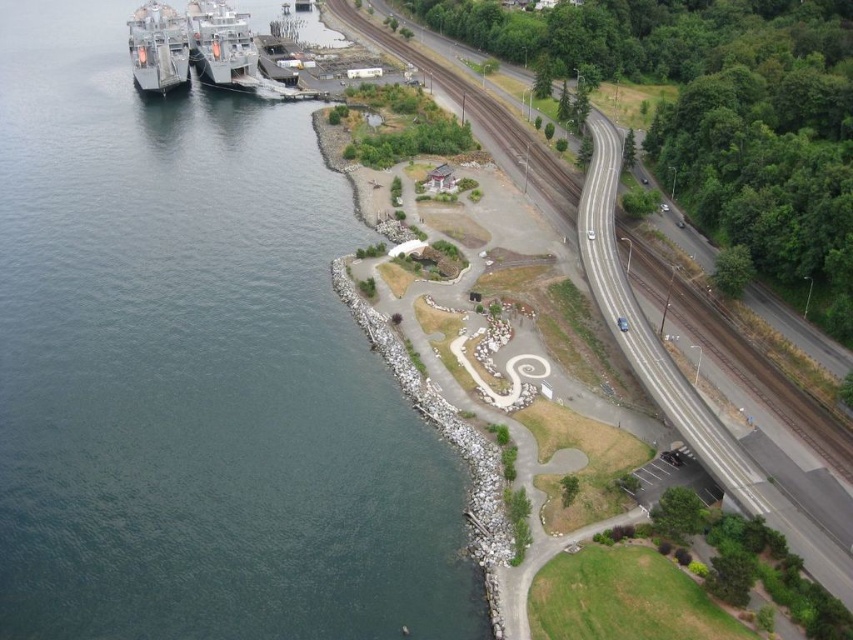
Question: Which of the following is the farthest from the observer?

Choices:
 (A) (x=198, y=42)
 (B) (x=601, y=294)
 (C) (x=257, y=282)
 (D) (x=186, y=48)

Answer: (A)

Question: Is dark blue water at left wider than gray asphalt train track at center?

Choices:
 (A) yes
 (B) no

Answer: (A)

Question: Does dark blue water at left lie in front of gray asphalt train track at center?

Choices:
 (A) yes
 (B) no

Answer: (A)

Question: Estimate the real-world distances between objects in this image. Which object is closer to the metallic gray ship at upper left?

Choices:
 (A) gray asphalt train track at center
 (B) dark blue water at left

Answer: (B)

Question: Is dark blue water at left to the right of metallic gray ship at upper left from the viewer's perspective?

Choices:
 (A) no
 (B) yes

Answer: (A)

Question: Which of these objects is positioned closest to the metallic gray ship at upper left?

Choices:
 (A) gray asphalt train track at center
 (B) dark blue water at left

Answer: (B)